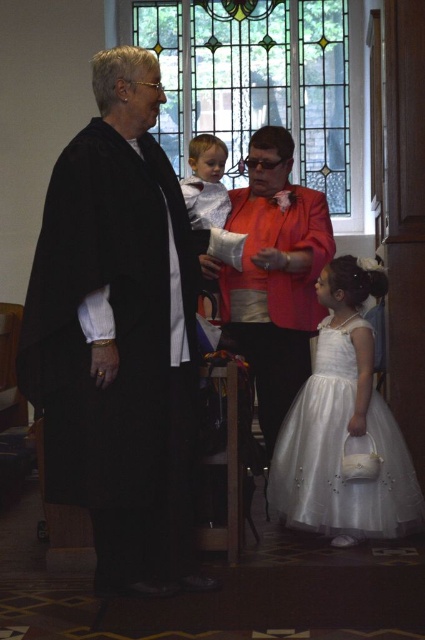
Question: Which of the following is the farthest from the observer?

Choices:
 (A) light gray fabric shirt at center
 (B) matte red jacket at center
 (C) white tulle dress at lower right

Answer: (B)

Question: Can you confirm if white tulle dress at lower right is bigger than light gray fabric shirt at center?

Choices:
 (A) no
 (B) yes

Answer: (A)

Question: Can you confirm if black matte robe at left is positioned above stained glass window at upper center?

Choices:
 (A) no
 (B) yes

Answer: (A)

Question: Can you confirm if black matte robe at left is positioned below white tulle dress at lower right?

Choices:
 (A) no
 (B) yes

Answer: (A)

Question: Estimate the real-world distances between objects in this image. Which object is farther from the matte red jacket at center?

Choices:
 (A) white tulle dress at lower right
 (B) light gray fabric shirt at center

Answer: (A)

Question: Which point is farther from the camera taking this photo?

Choices:
 (A) (159, 182)
 (B) (348, 433)
 (C) (195, 161)
 (D) (297, 241)

Answer: (C)